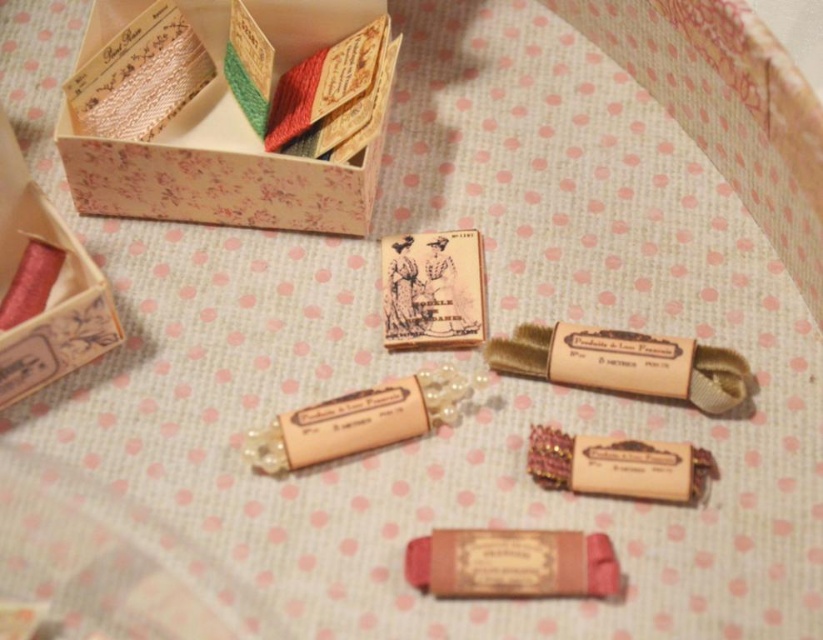
Describe the element at coordinates (217, 179) in the screenshot. I see `floral paper box at upper left` at that location.

Is floral paper box at upper left shorter than pearlized paper thread at center?

No.

Between point (361, 189) and point (387, 385), which one is positioned in front?

Positioned in front is point (387, 385).

At what (x,y) coordinates should I click in order to perform the action: click on floral paper box at upper left. Please return your answer as a coordinate pair (x, y). This screenshot has width=823, height=640. Looking at the image, I should click on (217, 179).

Based on the photo, between matte pink thread at center and pearlized paper thread at center, which one appears on the left side from the viewer's perspective?

Positioned to the left is pearlized paper thread at center.

Is matte pink thread at center above pearlized paper thread at center?

Actually, matte pink thread at center is below pearlized paper thread at center.

Image resolution: width=823 pixels, height=640 pixels. What do you see at coordinates (512, 563) in the screenshot?
I see `matte pink thread at center` at bounding box center [512, 563].

This screenshot has height=640, width=823. What are the coordinates of `matte pink thread at center` in the screenshot? It's located at pyautogui.click(x=512, y=563).

Who is lower down, matte pink wood box at left or pearlized paper thread at center?

pearlized paper thread at center is lower down.

You are a GUI agent. You are given a task and a screenshot of the screen. Output one action in this format:
    pyautogui.click(x=<x>, y=<y>)
    Task: Click on the matte pink wood box at left
    
    Given the screenshot: What is the action you would take?
    pyautogui.click(x=50, y=285)

Locate an element on the screen. matte pink wood box at left is located at coordinates (50, 285).